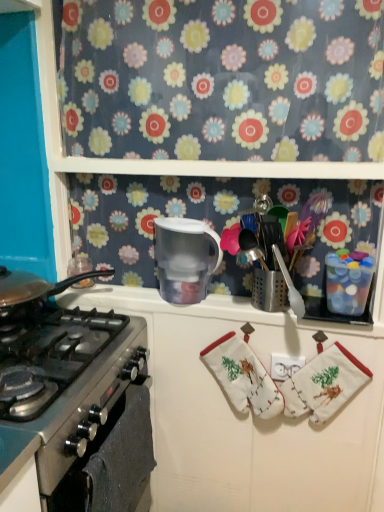
This screenshot has width=384, height=512. I want to click on vacant region above white cotton oven mitts at lower right (from a real-world perspective), so click(330, 337).